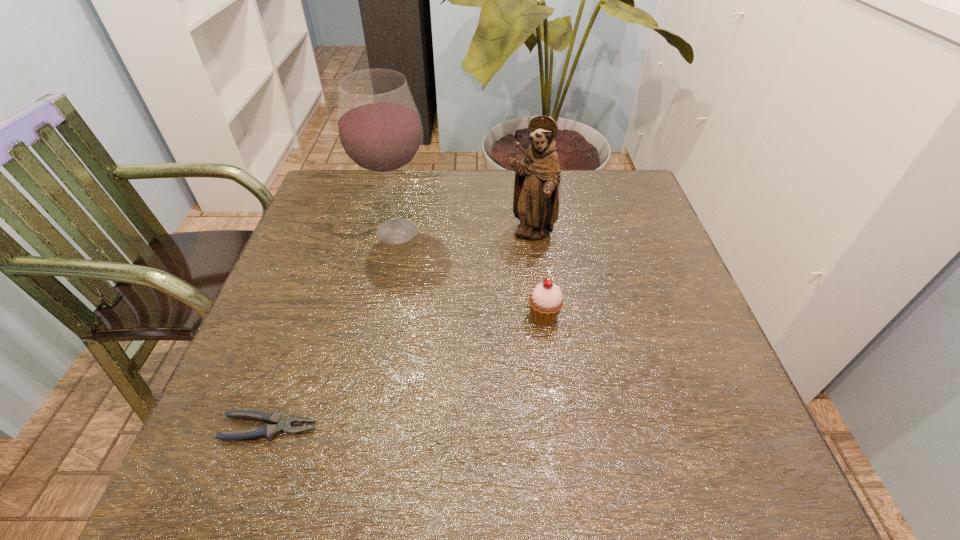
At what (x,y) coordinates should I click in order to perform the action: click on the tallest object. Please return your answer as a coordinate pair (x, y). Image resolution: width=960 pixels, height=540 pixels. Looking at the image, I should click on (379, 129).

Where is `figurine`? The height and width of the screenshot is (540, 960). figurine is located at coordinates (537, 177).

Image resolution: width=960 pixels, height=540 pixels. Find the location of `the third farthest object`. the third farthest object is located at coordinates (546, 300).

Where is `the second shortest object`? This screenshot has width=960, height=540. the second shortest object is located at coordinates (546, 300).

At what (x,y) coordinates should I click in order to perform the action: click on the shortest object. Please return your answer as a coordinate pair (x, y). The height and width of the screenshot is (540, 960). Looking at the image, I should click on (284, 424).

Where is `the nearest object`? This screenshot has height=540, width=960. the nearest object is located at coordinates (284, 424).

Identify the location of vacant space located 0.400m on the right of the tallest object. The image size is (960, 540). (591, 232).

This screenshot has height=540, width=960. I want to click on vacant space located 0.130m on the front-facing side of the figurine, so [538, 289].

Identify the location of free region located 0.140m on the right of the second shortest object. (629, 316).

Identify the location of vacant space located 0.290m at the gripping part of the shortest object. pyautogui.click(x=488, y=428).